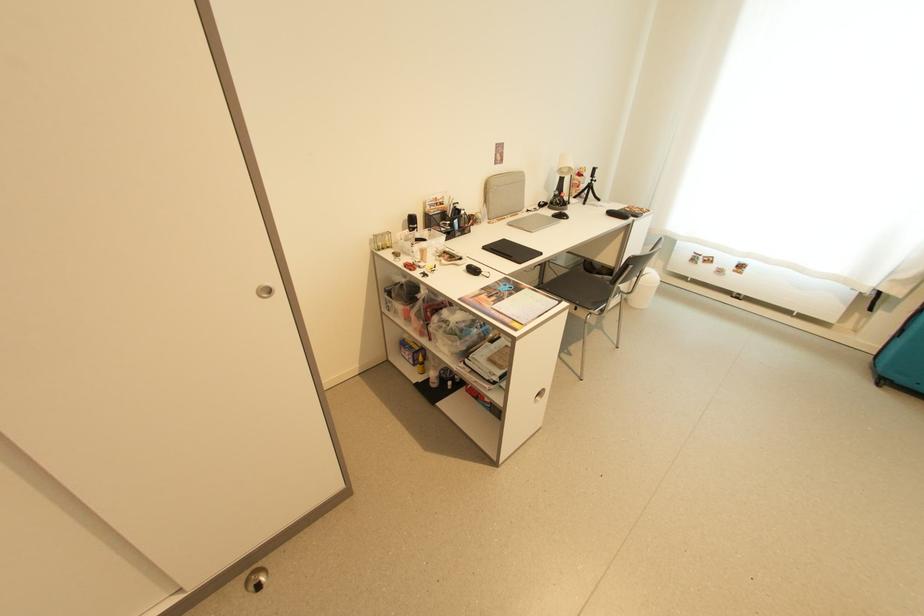
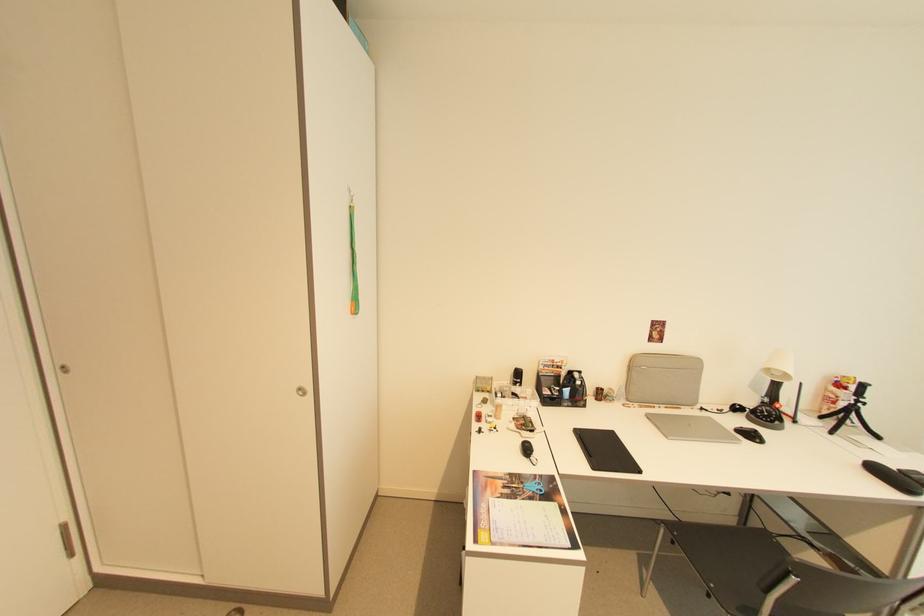
Find the pixel in the second image that matches [594,184] in the first image.

(857, 405)